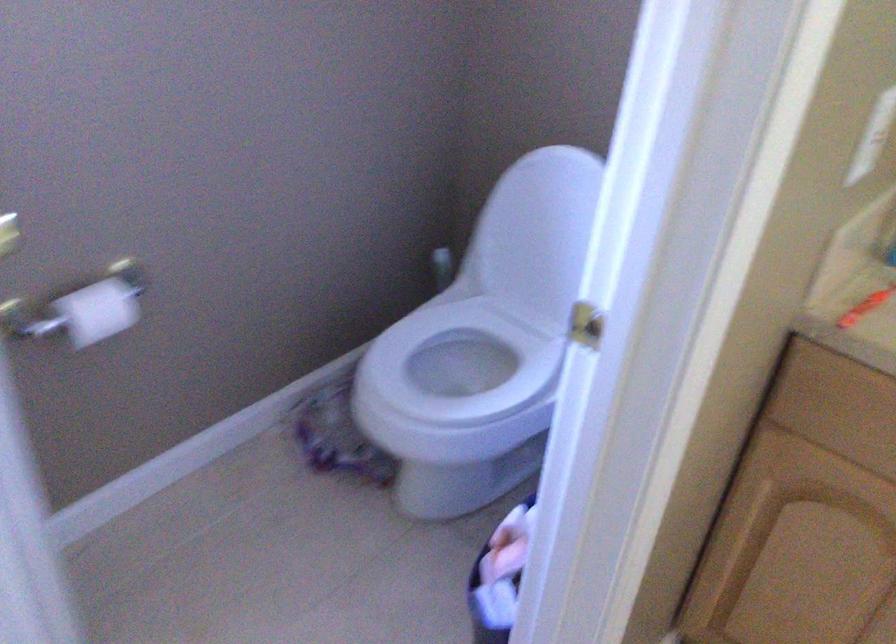
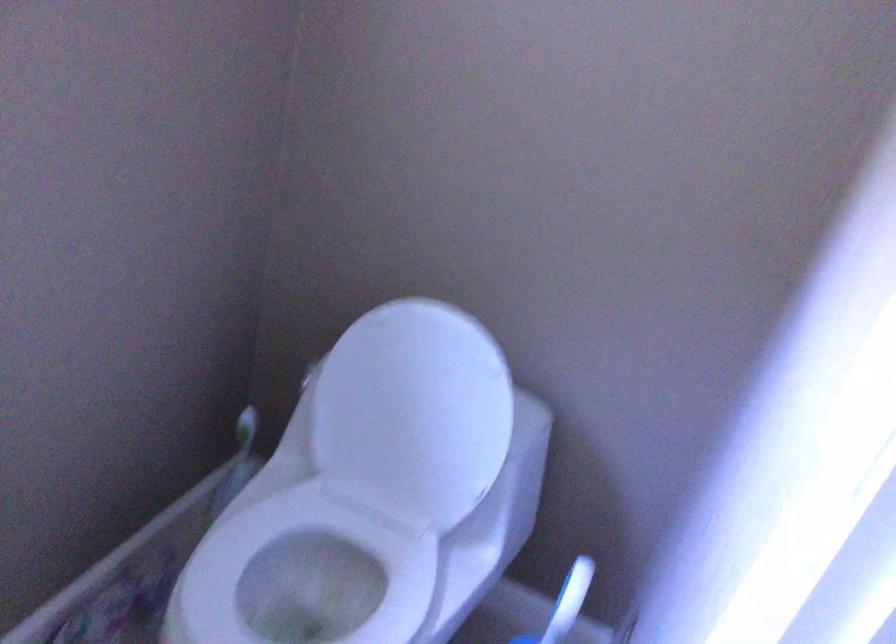
Question: The first image is from the beginning of the video and the second image is from the end. How did the camera likely rotate when shooting the video?

Choices:
 (A) Left
 (B) Right
 (C) Up
 (D) Down

Answer: (B)